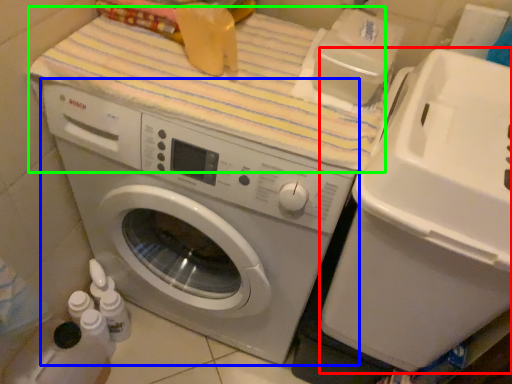
Question: Which object is the closest to the water cooler (highlighted by a red box)? Choose among these: washing machine (highlighted by a blue box) or bath towel (highlighted by a green box).

Choices:
 (A) washing machine
 (B) bath towel

Answer: (A)